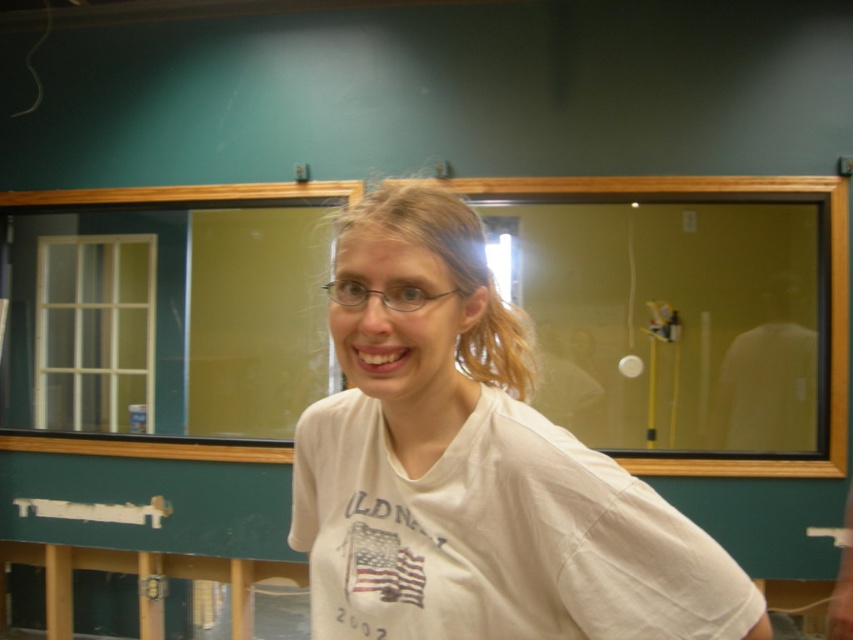
Question: Does white cotton t-shirt at center have a lesser width compared to clear plastic glasses at center?

Choices:
 (A) yes
 (B) no

Answer: (B)

Question: Which of the following is the farthest from the observer?

Choices:
 (A) clear plastic glasses at center
 (B) white cotton t-shirt at center

Answer: (A)

Question: Is white cotton t-shirt at center below clear plastic glasses at center?

Choices:
 (A) no
 (B) yes

Answer: (B)

Question: Is white cotton t-shirt at center further to the viewer compared to clear plastic glasses at center?

Choices:
 (A) no
 (B) yes

Answer: (A)